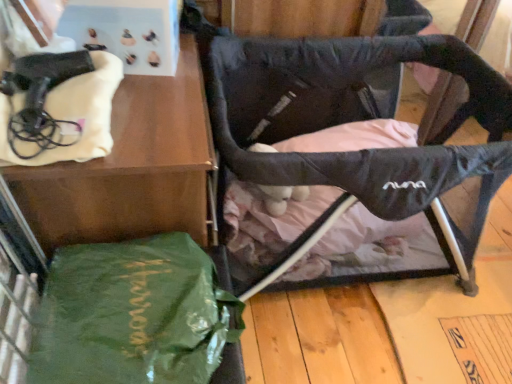
Question: In the image, is green fabric bag at lower left on the left side or the right side of green shiny tote bag at lower left?

Choices:
 (A) left
 (B) right

Answer: (A)

Question: In terms of height, does green fabric bag at lower left look taller or shorter compared to green shiny tote bag at lower left?

Choices:
 (A) short
 (B) tall

Answer: (B)

Question: Which is nearer to the black fabric swivel chair at center?

Choices:
 (A) green fabric bag at lower left
 (B) green shiny tote bag at lower left

Answer: (A)

Question: Which is farther from the black fabric swivel chair at center?

Choices:
 (A) green fabric bag at lower left
 (B) green shiny tote bag at lower left

Answer: (B)